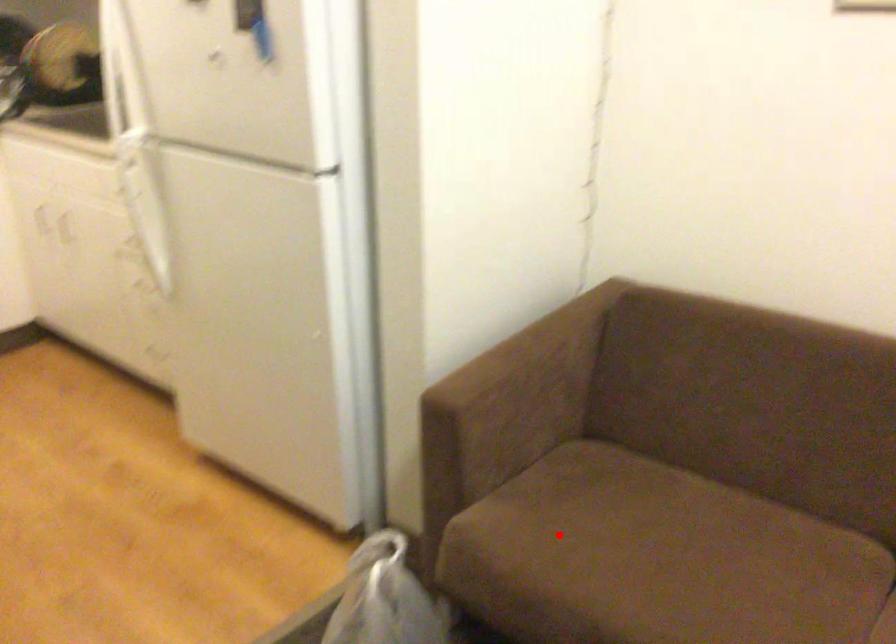
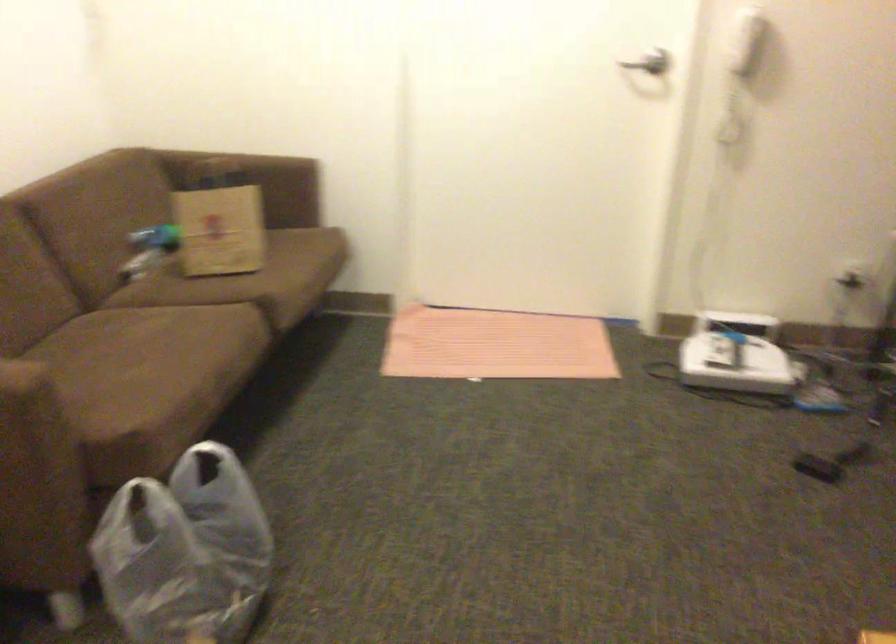
Where in the second image is the point corresponding to the highlighted location from the first image?

(110, 402)